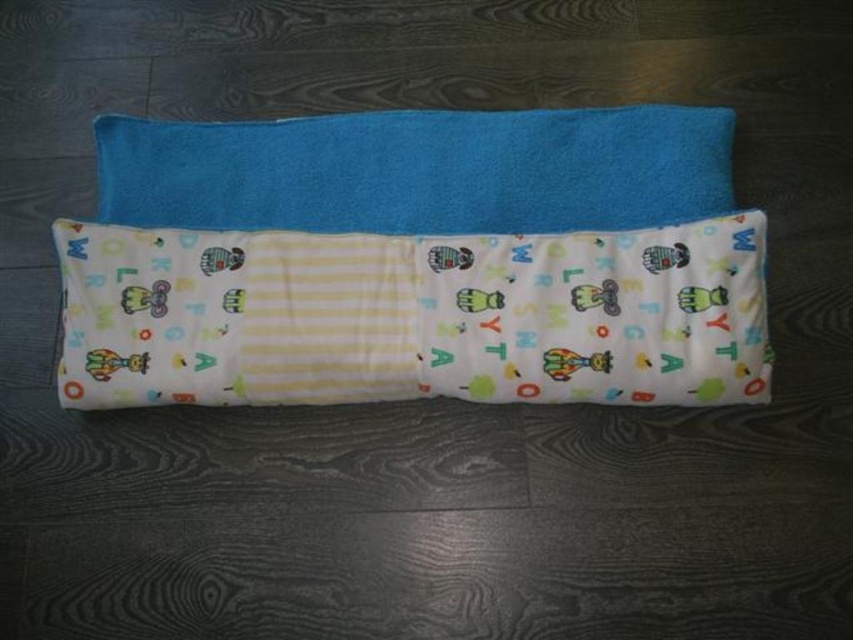
Consider the image. Does white cotton blanket at center have a greater width compared to blue soft towel at center?

Indeed, white cotton blanket at center has a greater width compared to blue soft towel at center.

Who is more distant from viewer, (744, 356) or (131, 184)?

Positioned behind is point (131, 184).

Is point (491, 348) farther from camera compared to point (650, 106)?

That is False.

This screenshot has height=640, width=853. Identify the location of white cotton blanket at center. click(x=413, y=316).